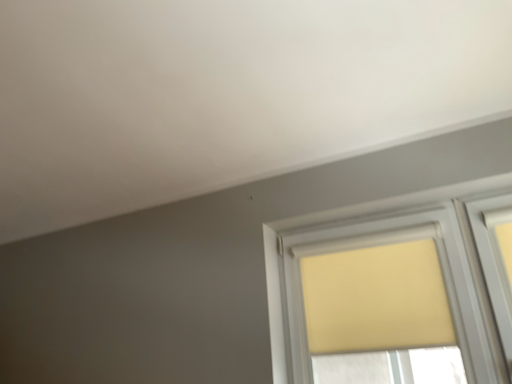
The height and width of the screenshot is (384, 512). Describe the element at coordinates (376, 299) in the screenshot. I see `beige fabric curtain at upper right` at that location.

Locate an element on the screen. Image resolution: width=512 pixels, height=384 pixels. beige fabric curtain at upper right is located at coordinates (376, 299).

You are a GUI agent. You are given a task and a screenshot of the screen. Output one action in this format:
    pyautogui.click(x=<x>, y=<y>)
    Task: Click on the beige fabric curtain at upper right
    The width and height of the screenshot is (512, 384).
    Given the screenshot: What is the action you would take?
    (376, 299)